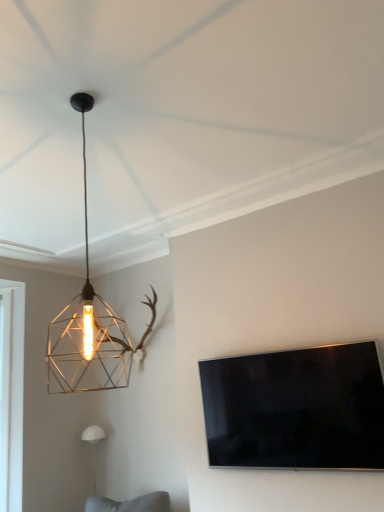
Question: Is white matte wall sconce at lower left, which is the first lamp from bottom to top, further to camera compared to flat-screen tv at right?

Choices:
 (A) no
 (B) yes

Answer: (B)

Question: Does white matte wall sconce at lower left, which is the second lamp from top to bottom, appear on the right side of flat-screen tv at right?

Choices:
 (A) no
 (B) yes

Answer: (A)

Question: Considering the relative sizes of white matte wall sconce at lower left, the first lamp in the back-to-front sequence, and flat-screen tv at right in the image provided, is white matte wall sconce at lower left, the first lamp in the back-to-front sequence, smaller than flat-screen tv at right?

Choices:
 (A) no
 (B) yes

Answer: (B)

Question: Is white matte wall sconce at lower left, which is the second lamp from top to bottom, wider than flat-screen tv at right?

Choices:
 (A) no
 (B) yes

Answer: (B)

Question: Is white matte wall sconce at lower left, which appears as the 1th lamp when viewed from the left, looking in the opposite direction of flat-screen tv at right?

Choices:
 (A) yes
 (B) no

Answer: (B)

Question: Does white matte wall sconce at lower left, positioned as the 2th lamp in right-to-left order, have a lesser width compared to flat-screen tv at right?

Choices:
 (A) no
 (B) yes

Answer: (A)

Question: From the image's perspective, is metallic wire cage at upper left, the first lamp from the top, above white matte wall sconce at lower left, which is the first lamp from bottom to top?

Choices:
 (A) no
 (B) yes

Answer: (B)

Question: Is metallic wire cage at upper left, arranged as the 2th lamp when ordered from the bottom, shorter than white matte wall sconce at lower left, the second lamp viewed from the front?

Choices:
 (A) yes
 (B) no

Answer: (B)

Question: Is metallic wire cage at upper left, which is the first lamp from front to back, taller than white matte wall sconce at lower left, the first lamp in the back-to-front sequence?

Choices:
 (A) yes
 (B) no

Answer: (A)

Question: Does metallic wire cage at upper left, the second lamp positioned from the back, turn towards white matte wall sconce at lower left, which is the second lamp from top to bottom?

Choices:
 (A) yes
 (B) no

Answer: (B)

Question: Can you confirm if metallic wire cage at upper left, which is the first lamp from front to back, is positioned to the left of white matte wall sconce at lower left, which appears as the 1th lamp when viewed from the left?

Choices:
 (A) yes
 (B) no

Answer: (B)

Question: From a real-world perspective, is metallic wire cage at upper left, positioned as the 1th lamp in right-to-left order, below white matte wall sconce at lower left, which is the first lamp from bottom to top?

Choices:
 (A) no
 (B) yes

Answer: (A)

Question: Does flat-screen tv at right have a smaller size compared to metallic wire cage at upper left, acting as the 2th lamp starting from the left?

Choices:
 (A) no
 (B) yes

Answer: (B)